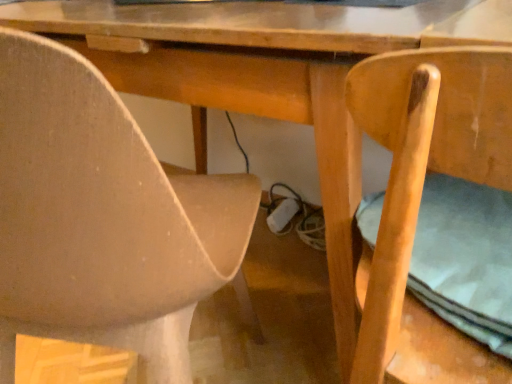
Question: Considering the relative sizes of matte beige chair at lower left, acting as the first chair starting from the left, and light brown wood chair at right, the second chair in the left-to-right sequence, in the image provided, is matte beige chair at lower left, acting as the first chair starting from the left, shorter than light brown wood chair at right, the second chair in the left-to-right sequence,?

Choices:
 (A) no
 (B) yes

Answer: (A)

Question: Does matte beige chair at lower left, which is the 2th chair from right to left, have a lesser width compared to light brown wood chair at right, which is the 1th chair in right-to-left order?

Choices:
 (A) yes
 (B) no

Answer: (B)

Question: Is matte beige chair at lower left, acting as the first chair starting from the left, oriented towards light brown wood chair at right, which is the 1th chair in right-to-left order?

Choices:
 (A) no
 (B) yes

Answer: (A)

Question: Is matte beige chair at lower left, acting as the first chair starting from the left, with light brown wood chair at right, which is the 1th chair in right-to-left order?

Choices:
 (A) no
 (B) yes

Answer: (A)

Question: From the image's perspective, is matte beige chair at lower left, which is the 2th chair from right to left, on light brown wood chair at right, which is the 1th chair in right-to-left order?

Choices:
 (A) no
 (B) yes

Answer: (B)

Question: Is matte beige chair at lower left, which is the 2th chair from right to left, at the right side of light brown wood chair at right, which is the 1th chair in right-to-left order?

Choices:
 (A) no
 (B) yes

Answer: (A)

Question: From the image's perspective, is light brown wood chair at right, the second chair in the left-to-right sequence, on top of matte beige chair at lower left, acting as the first chair starting from the left?

Choices:
 (A) no
 (B) yes

Answer: (A)

Question: Is light brown wood chair at right, which is the 1th chair in right-to-left order, facing towards matte beige chair at lower left, acting as the first chair starting from the left?

Choices:
 (A) no
 (B) yes

Answer: (A)

Question: Is light brown wood chair at right, which is the 1th chair in right-to-left order, looking in the opposite direction of matte beige chair at lower left, acting as the first chair starting from the left?

Choices:
 (A) no
 (B) yes

Answer: (A)

Question: Is light brown wood chair at right, which is the 1th chair in right-to-left order, completely or partially outside of matte beige chair at lower left, which is the 2th chair from right to left?

Choices:
 (A) no
 (B) yes

Answer: (B)

Question: Can you confirm if light brown wood chair at right, the second chair in the left-to-right sequence, is shorter than matte beige chair at lower left, acting as the first chair starting from the left?

Choices:
 (A) no
 (B) yes

Answer: (B)

Question: Is light brown wood chair at right, which is the 1th chair in right-to-left order, to the right of matte beige chair at lower left, acting as the first chair starting from the left, from the viewer's perspective?

Choices:
 (A) no
 (B) yes

Answer: (B)

Question: From the image's perspective, is matte beige chair at lower left, acting as the first chair starting from the left, located above or below light brown wood chair at right, the second chair in the left-to-right sequence?

Choices:
 (A) below
 (B) above

Answer: (B)